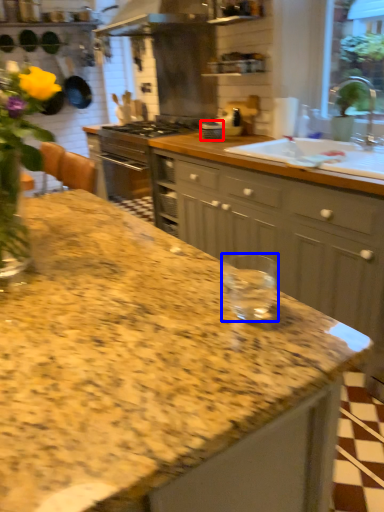
Question: Among these objects, which one is nearest to the camera, appliance (highlighted by a red box) or glass jar (highlighted by a blue box)?

Choices:
 (A) appliance
 (B) glass jar

Answer: (B)